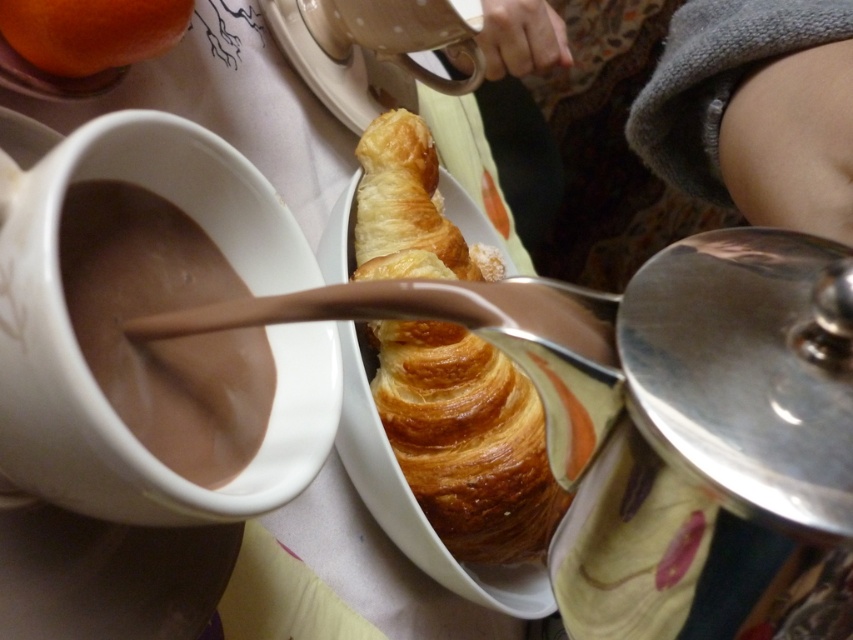
Consider the image. Who is positioned more to the left, golden brown flaky croissant at center or smooth chocolate at left?

From the viewer's perspective, smooth chocolate at left appears more on the left side.

Which of these two, golden brown flaky croissant at center or smooth chocolate at left, stands shorter?

With less height is smooth chocolate at left.

Where is `golden brown flaky croissant at center`? This screenshot has width=853, height=640. golden brown flaky croissant at center is located at coordinates (466, 440).

Can you confirm if golden brown flaky croissant at center is thinner than orange matte at upper left?

In fact, golden brown flaky croissant at center might be wider than orange matte at upper left.

What do you see at coordinates (466, 440) in the screenshot? I see `golden brown flaky croissant at center` at bounding box center [466, 440].

Who is more distant from viewer, (438, 529) or (15, 49)?

Positioned behind is point (438, 529).

The image size is (853, 640). In order to click on golden brown flaky croissant at center in this screenshot , I will do click(466, 440).

Which is more to the right, smooth chocolate at left or orange matte at upper left?

From the viewer's perspective, smooth chocolate at left appears more on the right side.

At what (x,y) coordinates should I click in order to perform the action: click on smooth chocolate at left. Please return your answer as a coordinate pair (x, y). Looking at the image, I should click on (165, 339).